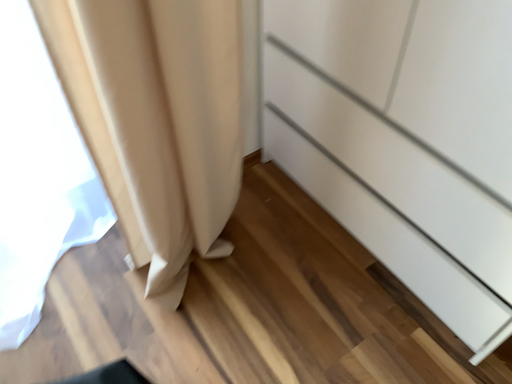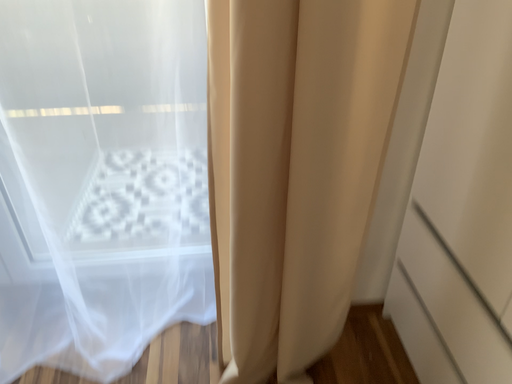
Question: How did the camera likely rotate when shooting the video?

Choices:
 (A) rotated left
 (B) rotated right

Answer: (A)